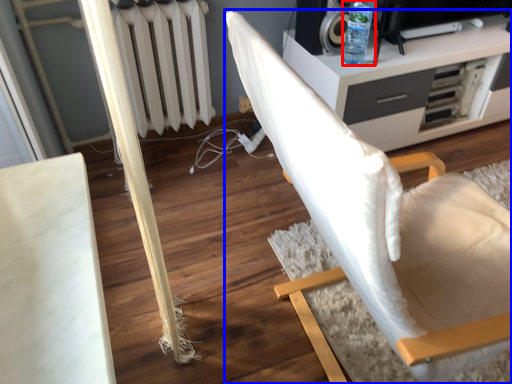
Question: Which object appears closest to the camera in this image, bottle (highlighted by a red box) or chair (highlighted by a blue box)?

Choices:
 (A) bottle
 (B) chair

Answer: (B)